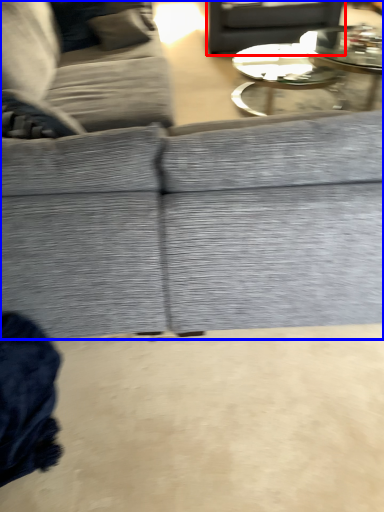
Question: Which object is further to the camera taking this photo, gray (highlighted by a red box) or studio couch (highlighted by a blue box)?

Choices:
 (A) gray
 (B) studio couch

Answer: (A)